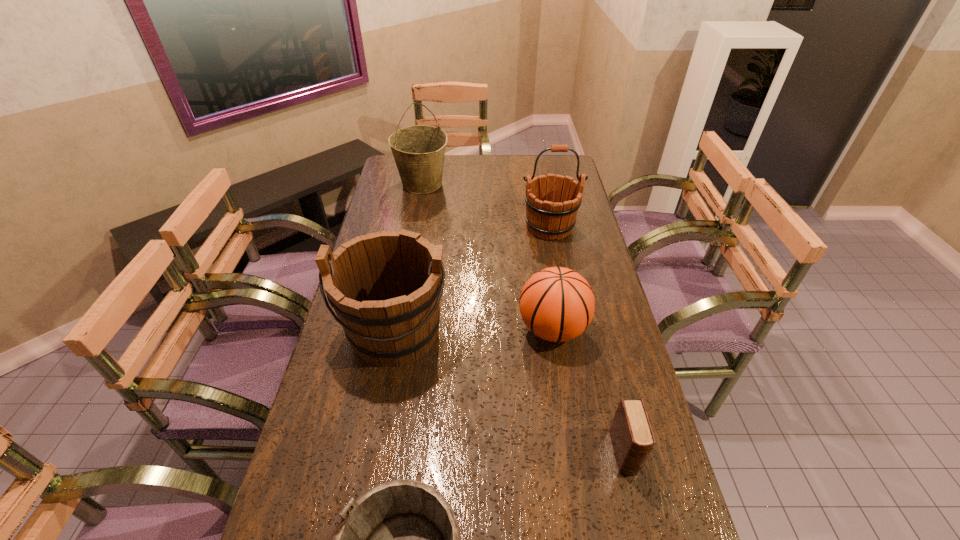
Where is `vacant area that lies between the farthest wine bucket and the basketball`? The height and width of the screenshot is (540, 960). vacant area that lies between the farthest wine bucket and the basketball is located at coordinates (488, 256).

Where is `free space between the third farthest wine bucket and the diary`? This screenshot has height=540, width=960. free space between the third farthest wine bucket and the diary is located at coordinates (510, 392).

Locate an element on the screen. The width and height of the screenshot is (960, 540). object that is the fourth nearest to the nearest object is located at coordinates (546, 216).

Identify which object is the second closest to the shortest wine bucket. Please provide its 2D coordinates. Your answer should be formatted as a tuple, i.e. [(x, y)], where the tuple contains the x and y coordinates of a point satisfying the conditions above.

[(632, 437)]

Locate an element on the screen. This screenshot has height=540, width=960. wine bucket object that ranks as the third closest to the diary is located at coordinates (546, 216).

Select which wine bucket is the closest to the second farthest object. Please provide its 2D coordinates. Your answer should be formatted as a tuple, i.e. [(x, y)], where the tuple contains the x and y coordinates of a point satisfying the conditions above.

[(419, 150)]